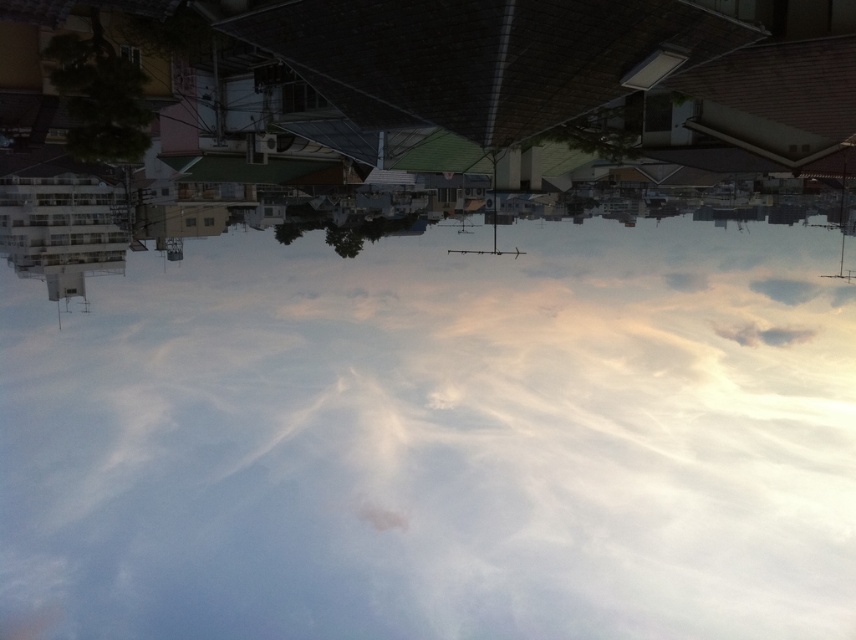
Is white cloud at upper center to the right of white fluffy cloud at upper right from the viewer's perspective?

In fact, white cloud at upper center is to the left of white fluffy cloud at upper right.

Does white cloud at upper center have a lesser height compared to white fluffy cloud at upper right?

In fact, white cloud at upper center may be taller than white fluffy cloud at upper right.

Which is behind, point (522, 472) or point (777, 332)?

Point (522, 472)

You are a GUI agent. You are given a task and a screenshot of the screen. Output one action in this format:
    pyautogui.click(x=<x>, y=<y>)
    Task: Click on the white cloud at upper center
    The height and width of the screenshot is (640, 856).
    Given the screenshot: What is the action you would take?
    pyautogui.click(x=428, y=422)